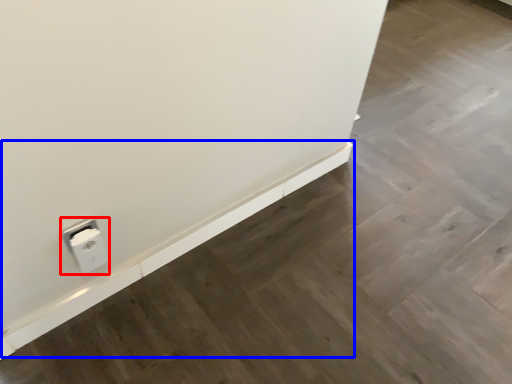
Question: Which of the following is the closest to the observer, power plugs and sockets (highlighted by a red box) or ledge (highlighted by a blue box)?

Choices:
 (A) power plugs and sockets
 (B) ledge

Answer: (A)